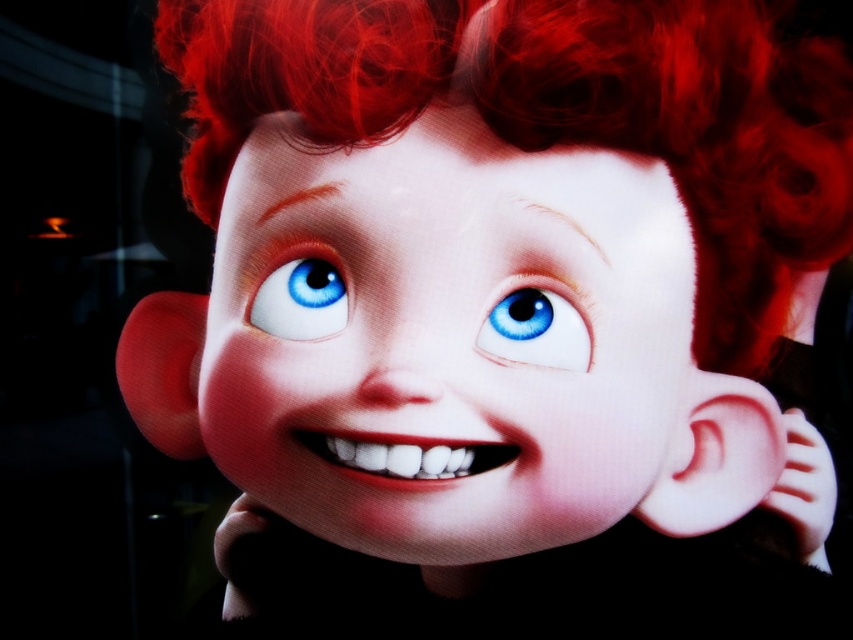
Question: Which of the following is the farthest from the observer?

Choices:
 (A) (639, 172)
 (B) (503, 300)

Answer: (A)

Question: Is blue glossy eye at center to the right of blue glossy eye at upper center from the viewer's perspective?

Choices:
 (A) yes
 (B) no

Answer: (A)

Question: Which of the following is the closest to the observer?

Choices:
 (A) blue glossy eye at upper center
 (B) blue glossy eye at center
 (C) smooth skin face at center

Answer: (C)

Question: Does smooth skin face at center appear on the right side of blue glossy eye at upper center?

Choices:
 (A) no
 (B) yes

Answer: (B)

Question: Is smooth skin face at center behind blue glossy eye at center?

Choices:
 (A) no
 (B) yes

Answer: (A)

Question: Among these objects, which one is nearest to the camera?

Choices:
 (A) blue glossy eye at upper center
 (B) blue glossy eye at center

Answer: (B)